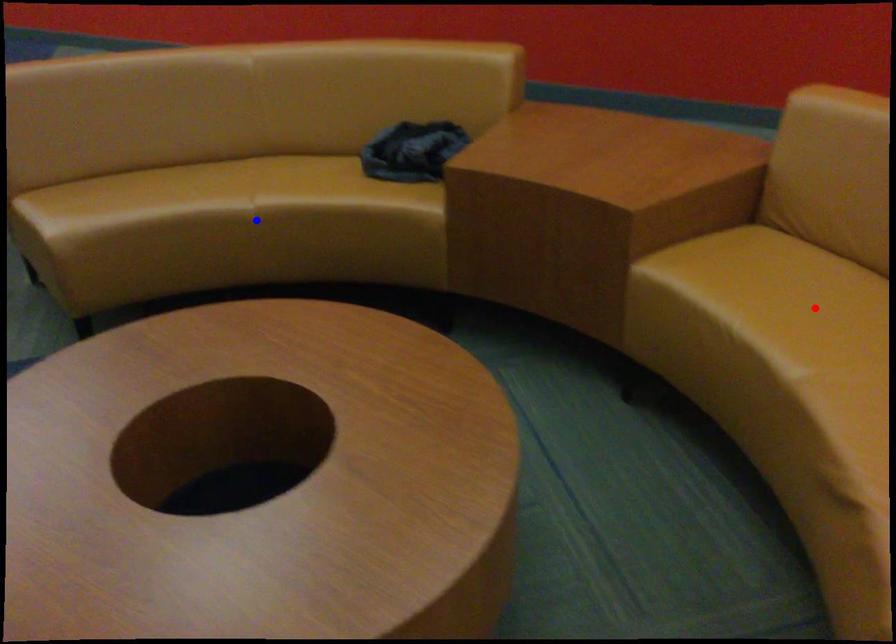
Question: Which of the two points in the image is closer to the camera?

Choices:
 (A) Blue point is closer.
 (B) Red point is closer.

Answer: (B)